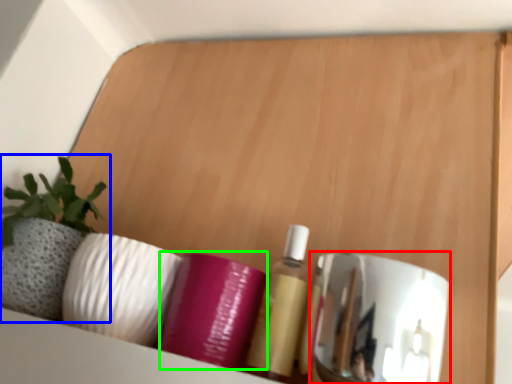
Question: Which object is the closest to the mirror (highlighted by a red box)? Choose among these: houseplant (highlighted by a blue box) or toiletry (highlighted by a green box).

Choices:
 (A) houseplant
 (B) toiletry

Answer: (B)